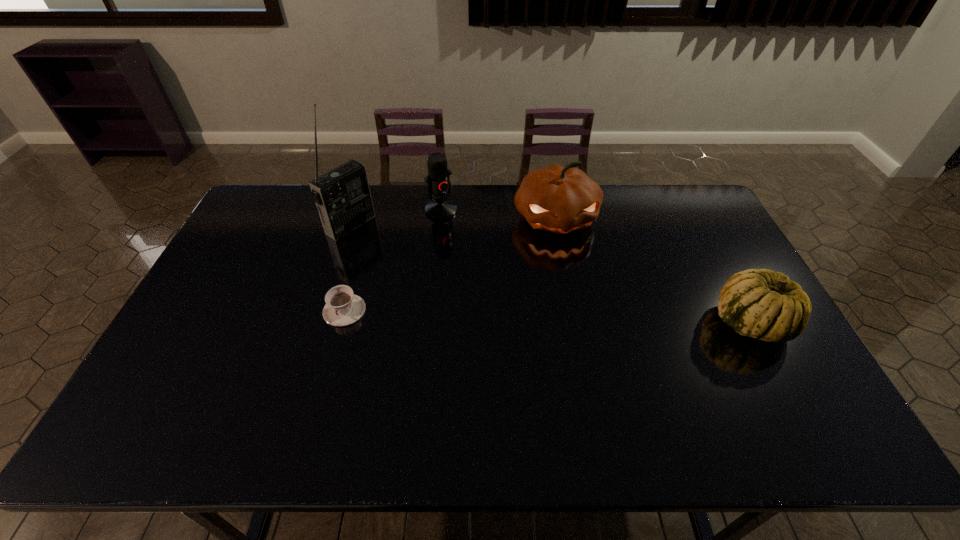
This screenshot has height=540, width=960. What are the coordinates of `object that is at the right edge` in the screenshot? It's located at (758, 303).

Image resolution: width=960 pixels, height=540 pixels. In the image, there is a desktop. Identify the location of free space at the far edge. (622, 200).

The width and height of the screenshot is (960, 540). I want to click on blank area at the near edge, so click(x=278, y=384).

Where is `vacant space at the left edge`? The height and width of the screenshot is (540, 960). vacant space at the left edge is located at coordinates click(207, 300).

Locate an element on the screen. Image resolution: width=960 pixels, height=540 pixels. vacant space at the right edge of the desktop is located at coordinates (707, 288).

In the image, there is a desktop. What are the coordinates of `vacant area at the far left corner` in the screenshot? It's located at (265, 210).

You are a GUI agent. You are given a task and a screenshot of the screen. Output one action in this format:
    pyautogui.click(x=<x>, y=<y>)
    Task: Click on the vacant space at the far right corner of the desktop
    The image size is (960, 540).
    Given the screenshot: What is the action you would take?
    pyautogui.click(x=702, y=209)

Find the location of a particular element. free spot between the third object from right to left and the rightmost object is located at coordinates (596, 266).

The width and height of the screenshot is (960, 540). I want to click on free space between the fourth object from left to right and the tallest object, so click(x=453, y=221).

Find the location of a particular element. This screenshot has height=540, width=960. vacant region between the pumpkin and the microphone is located at coordinates (498, 214).